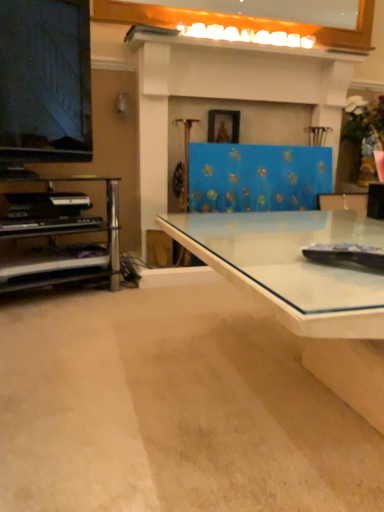
Where is `matte black television at left`? This screenshot has height=512, width=384. matte black television at left is located at coordinates (45, 82).

What is the approximate height of metallic silver shelf at left?

metallic silver shelf at left is 18.68 inches in height.

Measure the distance between white glossy mantle at upper center and camera.

white glossy mantle at upper center is 1.97 meters away from camera.

Identify the location of matte black television at left. (45, 82).

Could you tell me if transparent glass desk at center is facing metallic silver shelf at left?

No, transparent glass desk at center is not oriented towards metallic silver shelf at left.

Considering the relative sizes of transparent glass desk at center and metallic silver shelf at left in the image provided, is transparent glass desk at center smaller than metallic silver shelf at left?

No, transparent glass desk at center is not smaller than metallic silver shelf at left.

From the image's perspective, relative to metallic silver shelf at left, is transparent glass desk at center above or below?

Clearly, from the image's perspective, transparent glass desk at center is below metallic silver shelf at left.

Is transparent glass desk at center next to metallic silver shelf at left and touching it?

No, transparent glass desk at center is not touching metallic silver shelf at left.

Based on the photo, considering the sizes of objects transparent glass desk at center and black matte piano at left in the image provided, who is bigger, transparent glass desk at center or black matte piano at left?

transparent glass desk at center.

Does transparent glass desk at center have a greater width compared to black matte piano at left?

Yes.

Is black matte piano at left a part of transparent glass desk at center?

Actually, black matte piano at left is outside transparent glass desk at center.

From a real-world perspective, is transparent glass desk at center positioned over black matte piano at left based on gravity?

No, from a real-world perspective, transparent glass desk at center is not above black matte piano at left.

Locate an element on the screen. Image resolution: width=384 pixels, height=512 pixels. mantle located on the right of metallic silver shelf at left is located at coordinates 242,39.

Is white glossy mantle at upper center in front of metallic silver shelf at left?

No, white glossy mantle at upper center is further to the viewer.

How many degrees apart are the facing directions of white glossy mantle at upper center and metallic silver shelf at left?

The angle between the facing direction of white glossy mantle at upper center and the facing direction of metallic silver shelf at left is 20.6 degrees.

From a real-world perspective, is white glossy mantle at upper center physically below metallic silver shelf at left?

Incorrect, from a real-world perspective, white glossy mantle at upper center is higher than metallic silver shelf at left.

Considering the relative positions of transparent glass desk at center and matte black television at left in the image provided, is transparent glass desk at center to the left of matte black television at left from the viewer's perspective?

Incorrect, transparent glass desk at center is not on the left side of matte black television at left.

From a real-world perspective, relative to matte black television at left, is transparent glass desk at center vertically above or below?

transparent glass desk at center is situated lower than matte black television at left in the real world.

Is point (199, 253) positioned after point (24, 136)?

That is False.

Is transparent glass desk at center next to matte black television at left and touching it?

transparent glass desk at center and matte black television at left are clearly separated.

Is white glossy mantle at upper center surrounding black matte piano at left?

No, black matte piano at left is not surrounded by white glossy mantle at upper center.

Which is behind, point (140, 34) or point (97, 227)?

The point (140, 34) is behind.

Which is more to the left, white glossy mantle at upper center or black matte piano at left?

black matte piano at left.

From the image's perspective, which is above, metallic silver shelf at left or matte black television at left?

From the image's view, matte black television at left is above.

In terms of height, does metallic silver shelf at left look taller or shorter compared to matte black television at left?

metallic silver shelf at left is shorter than matte black television at left.

Considering the relative positions of metallic silver shelf at left and matte black television at left in the image provided, is metallic silver shelf at left to the right of matte black television at left from the viewer's perspective?

No.

Is metallic silver shelf at left in contact with matte black television at left?

No, metallic silver shelf at left is not next to matte black television at left.

How different are the orientations of matte black television at left and metallic silver shelf at left in degrees?

There is a 1.65-degree angle between the facing directions of matte black television at left and metallic silver shelf at left.

Is matte black television at left taller or shorter than metallic silver shelf at left?

Clearly, matte black television at left is taller compared to metallic silver shelf at left.

From a real-world perspective, is matte black television at left positioned over metallic silver shelf at left based on gravity?

Yes, from a real-world perspective, matte black television at left is over metallic silver shelf at left

Where is `desk that is on the right side of metallic silver shelf at left`? desk that is on the right side of metallic silver shelf at left is located at coordinates (304, 289).

The width and height of the screenshot is (384, 512). I want to click on piano on the left of transparent glass desk at center, so click(x=50, y=225).

Based on their spatial positions, is transparent glass desk at center or metallic silver shelf at left closer to white glossy mantle at upper center?

metallic silver shelf at left is positioned closer to the anchor white glossy mantle at upper center.

When comparing their distances from matte black television at left, does black matte piano at left or white glossy mantle at upper center seem further?

Among the two, white glossy mantle at upper center is located further to matte black television at left.

Estimate the real-world distances between objects in this image. Which object is closer to metallic silver shelf at left, transparent glass desk at center or black matte piano at left?

black matte piano at left is closer to metallic silver shelf at left.

Which object lies nearer to the anchor point transparent glass desk at center, matte black television at left or white glossy mantle at upper center?

The object closer to transparent glass desk at center is matte black television at left.

From the picture: Estimate the real-world distances between objects in this image. Which object is further from metallic silver shelf at left, matte black television at left or transparent glass desk at center?

transparent glass desk at center.

Which object lies nearer to the anchor point black matte piano at left, transparent glass desk at center or white glossy mantle at upper center?

transparent glass desk at center.

Looking at the image, which one is located further to metallic silver shelf at left, matte black television at left or white glossy mantle at upper center?

Based on the image, white glossy mantle at upper center appears to be further to metallic silver shelf at left.

When comparing their distances from white glossy mantle at upper center, does matte black television at left or transparent glass desk at center seem closer?

matte black television at left.

This screenshot has width=384, height=512. Identify the location of shelf between transparent glass desk at center and white glossy mantle at upper center along the z-axis. (57, 237).

Where is `television between metallic silver shelf at left and transparent glass desk at center in the horizontal direction`? The height and width of the screenshot is (512, 384). television between metallic silver shelf at left and transparent glass desk at center in the horizontal direction is located at coordinates (45, 82).

Identify the location of piano between matte black television at left and metallic silver shelf at left from top to bottom. (50, 225).

The height and width of the screenshot is (512, 384). Identify the location of piano between transparent glass desk at center and white glossy mantle at upper center in the front-back direction. (50, 225).